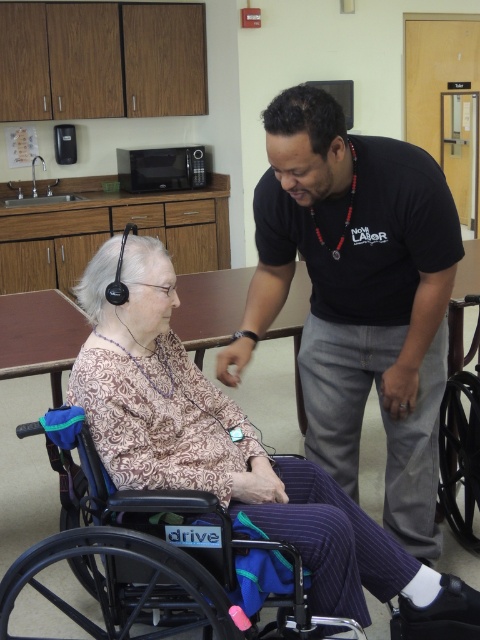
This screenshot has width=480, height=640. In order to click on black cotton shirt at center in this screenshot , I will do `click(358, 296)`.

Which is above, black cotton shirt at center or black plastic wheelchair at lower left?

Positioned higher is black cotton shirt at center.

Where is `black cotton shirt at center`? black cotton shirt at center is located at coordinates (358, 296).

The width and height of the screenshot is (480, 640). I want to click on black cotton shirt at center, so click(358, 296).

Can you confirm if black cotton shirt at center is positioned below patterned fabric dress at lower left?

No, black cotton shirt at center is not below patterned fabric dress at lower left.

Can you confirm if black cotton shirt at center is thinner than patterned fabric dress at lower left?

Indeed, black cotton shirt at center has a lesser width compared to patterned fabric dress at lower left.

Is point (348, 385) in front of point (422, 579)?

No, it is behind (422, 579).

Identify the location of black cotton shirt at center. (358, 296).

Who is lower down, black plastic wheelchair at lower left or black plastic wheelchair at lower right?

black plastic wheelchair at lower left

Can you confirm if black plastic wheelchair at lower left is taller than black plastic wheelchair at lower right?

Incorrect, black plastic wheelchair at lower left's height is not larger of black plastic wheelchair at lower right's.

What are the coordinates of `black plastic wheelchair at lower left` in the screenshot? It's located at (83, 580).